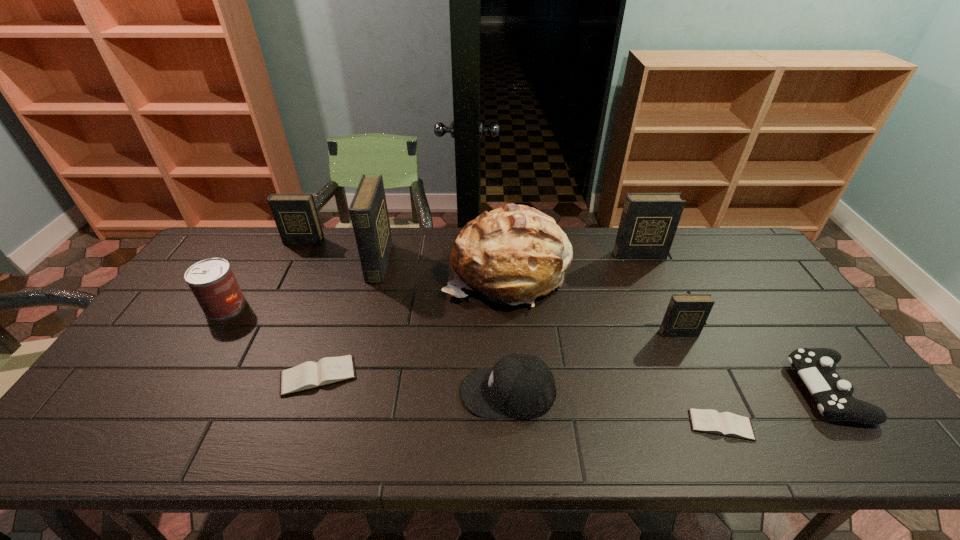
Locate an element on the screen. This screenshot has width=960, height=540. control is located at coordinates (816, 366).

Locate an element on the screen. This screenshot has height=540, width=960. the rightmost object is located at coordinates (816, 366).

At what (x,y) coordinates should I click in order to perform the action: click on the left brown diary. Please return your answer as a coordinate pair (x, y). The width and height of the screenshot is (960, 540). Looking at the image, I should click on (329, 370).

Identify the location of the farther brown diary. (329, 370).

Find the location of a particular element. the nearer brown diary is located at coordinates (728, 424).

Image resolution: width=960 pixels, height=540 pixels. Find the location of `the shortest diary`. the shortest diary is located at coordinates click(728, 424).

Where is `free space located 0.160m on the front cover of the tallest object`? free space located 0.160m on the front cover of the tallest object is located at coordinates (437, 264).

Locate an element on the screen. The width and height of the screenshot is (960, 540). free space located 0.130m on the front cover of the second tallest diary is located at coordinates (652, 286).

You are a GUI agent. You are given a task and a screenshot of the screen. Output one action in this format:
    pyautogui.click(x=<x>, y=<y>)
    Task: Click on the vacant space located 0.380m on the front of the bread
    This screenshot has height=540, width=960.
    Given the screenshot: What is the action you would take?
    pyautogui.click(x=519, y=436)

Find the location of a particular element. The width and height of the screenshot is (960, 540). vacant space situated 0.310m on the front cover of the ninth object from right to left is located at coordinates (270, 308).